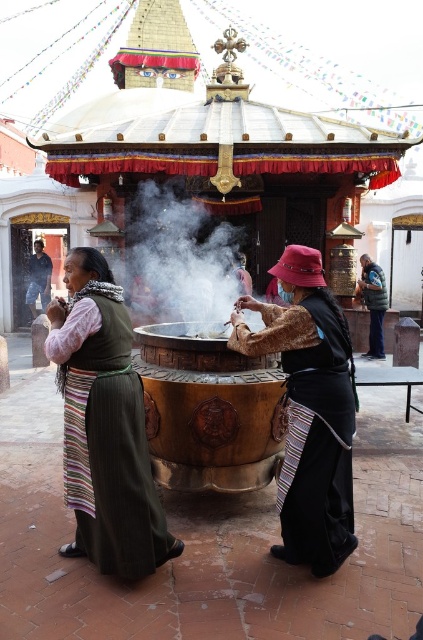
Question: Which of the following is the closest to the observer?

Choices:
 (A) click(x=33, y=252)
 (B) click(x=376, y=344)

Answer: (B)

Question: Can you confirm if green woven skirt at center is positioned to the left of velvet brown hat at center?

Choices:
 (A) no
 (B) yes

Answer: (B)

Question: Which point is farther to the camera?

Choices:
 (A) (288, 262)
 (B) (43, 308)

Answer: (B)

Question: Is velvet brown hat at center wider than dark blue jeans at lower left?

Choices:
 (A) yes
 (B) no

Answer: (A)

Question: Is smoketransparent at center wider than dark blue jeans at lower left?

Choices:
 (A) no
 (B) yes

Answer: (B)

Question: Considering the real-world distances, which object is closest to the green woven skirt at center?

Choices:
 (A) smoketransparent at center
 (B) dark blue puffy jacket at center

Answer: (A)